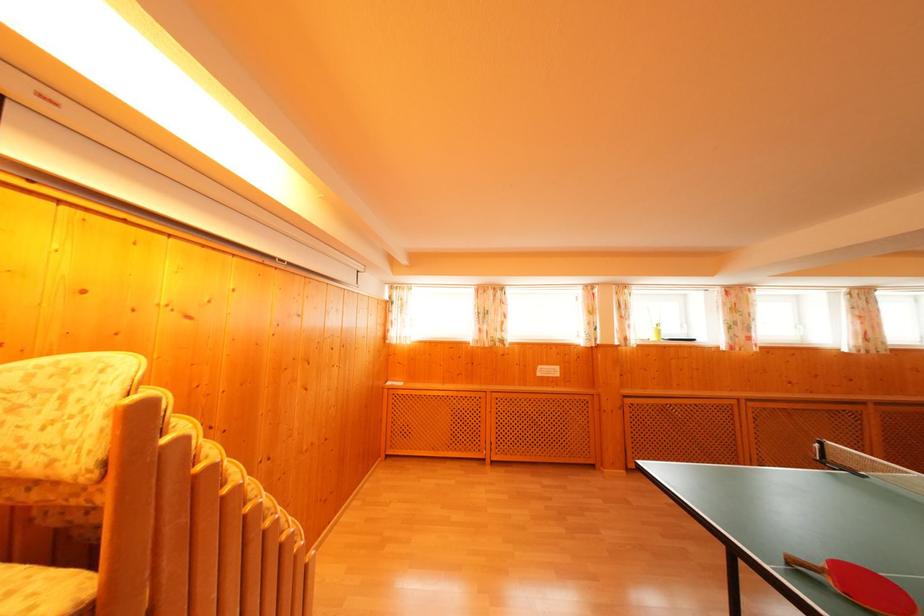
The height and width of the screenshot is (616, 924). I want to click on chair sitting surface, so pyautogui.click(x=28, y=591).